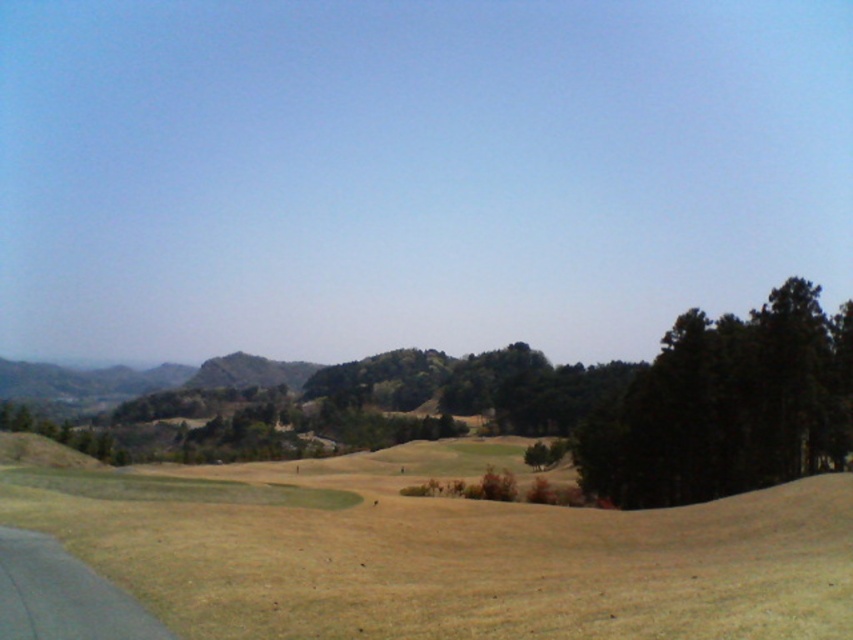
You are a golfer standing on the green grassy field at center and want to hit a ball to the dark green textured trees at right. Considering the size difference between the two, which area would require a more powerful hit to cover the distance?

The dark green textured trees at right are smaller than the green grassy field at center according to the description. However, the question is about distance, not size. The description doesn not provide information about the distance between the objects, so we cannot determine which requires a more powerful hit based on size alone.

Based on the scene description, can you determine if the green grassy field at center is wider than the dark green textured trees at right?

The green grassy field at center might be wider than dark green textured trees at right according to the description.

You are standing in the middle of the green grassy field at center. Looking around, what is the most prominent feature directly in front of you?

The most prominent feature directly in front of you is the paved path or road on the left side, as described in the scene.